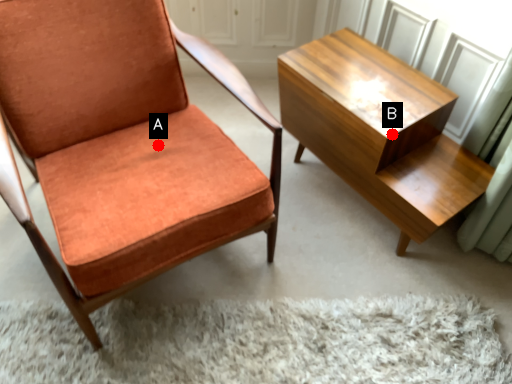
Question: Two points are circled on the image, labeled by A and B beside each circle. Which point appears farthest from the camera in this image?

Choices:
 (A) A is further
 (B) B is further

Answer: (A)